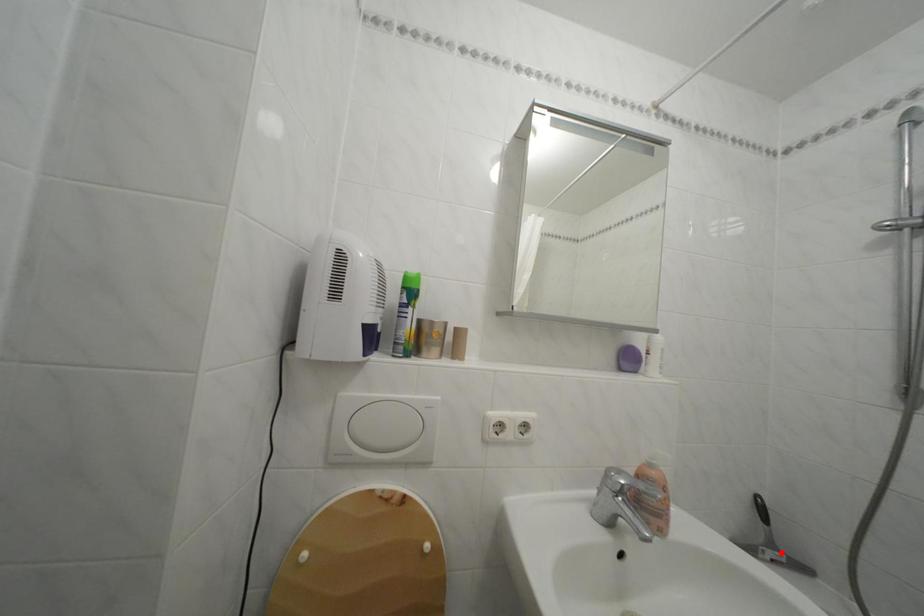
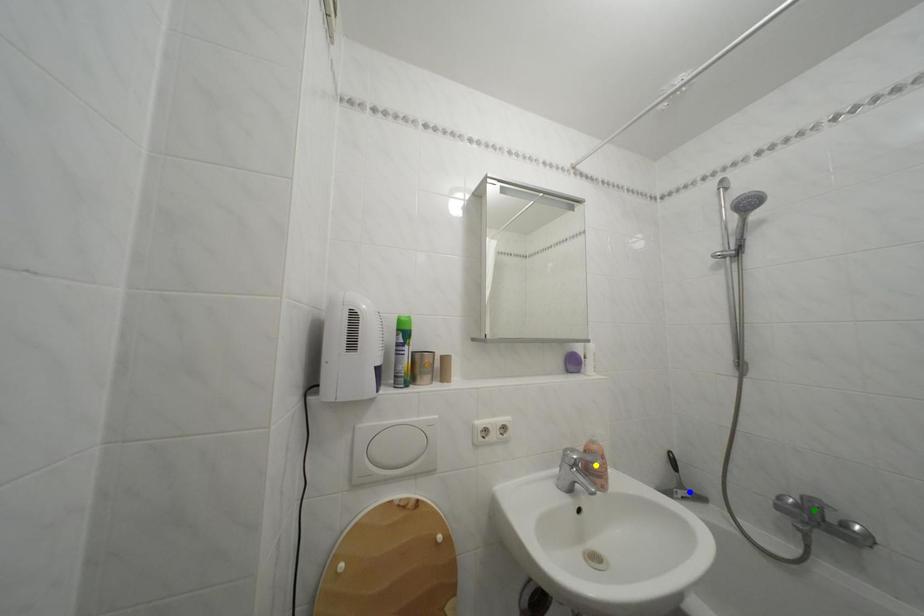
Question: I am providing you with two images of the same scene from different viewpoints. A red point is marked on the first image. You are given multiple points on the second image. Which point in image 2 is actually the same real-world point as the red point in image 1?

Choices:
 (A) blue point
 (B) green point
 (C) yellow point

Answer: (A)